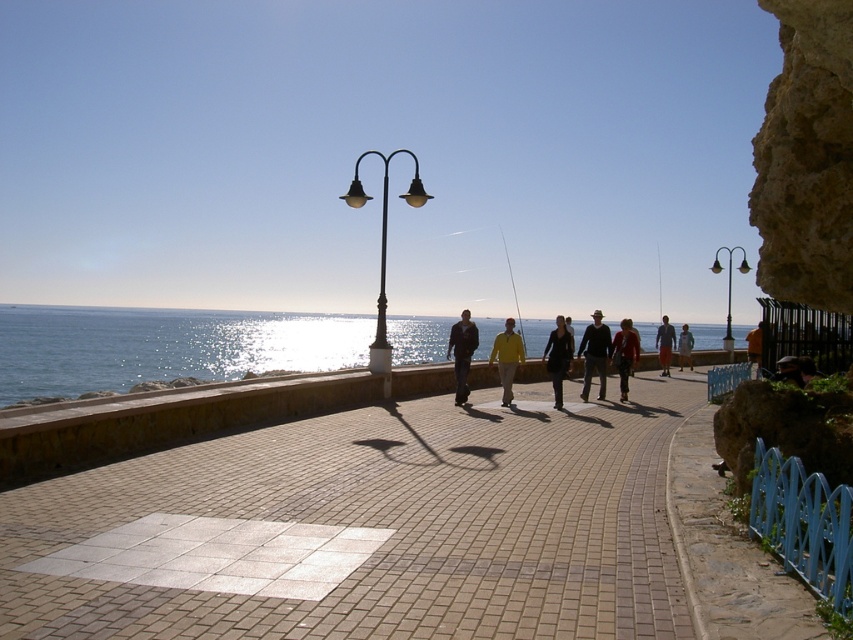
Question: Which object is the closest to the light brown fabric shorts at center?

Choices:
 (A) metallic pole at center
 (B) light brown leather jacket at center
 (C) matte brown hat at center

Answer: (B)

Question: Which object is positioned farthest from the matte yellow jacket at center?

Choices:
 (A) metallic fishing pole at right
 (B) light brown fabric shorts at center
 (C) dark blue jacket at center
 (D) metallic gold lamppost at right

Answer: (A)

Question: Based on their relative distances, which object is nearer to the metallic fishing pole at right?

Choices:
 (A) shiny blue water at center
 (B) matte yellow jacket at center
 (C) metallic gold lamppost at right

Answer: (C)

Question: Is yellow matte jacket at center to the left of light brown fabric shorts at center from the viewer's perspective?

Choices:
 (A) no
 (B) yes

Answer: (B)

Question: Can you confirm if shiny blue water at center is smaller than light brown fabric shorts at center?

Choices:
 (A) no
 (B) yes

Answer: (A)

Question: Does yellow matte jacket at center appear on the right side of light brown fabric shorts at center?

Choices:
 (A) yes
 (B) no

Answer: (B)